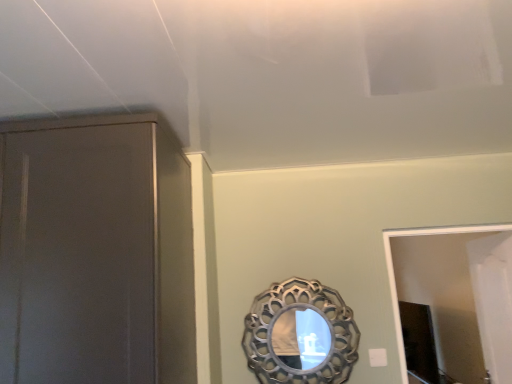
Measure the distance between silver metallic mirror at center and camera.

A distance of 6.78 feet exists between silver metallic mirror at center and camera.

Identify the location of silver metallic mirror at center. (300, 334).

What do you see at coordinates (300, 334) in the screenshot?
I see `silver metallic mirror at center` at bounding box center [300, 334].

Locate an element on the screen. Image resolution: width=512 pixels, height=384 pixels. silver metallic mirror at center is located at coordinates (300, 334).